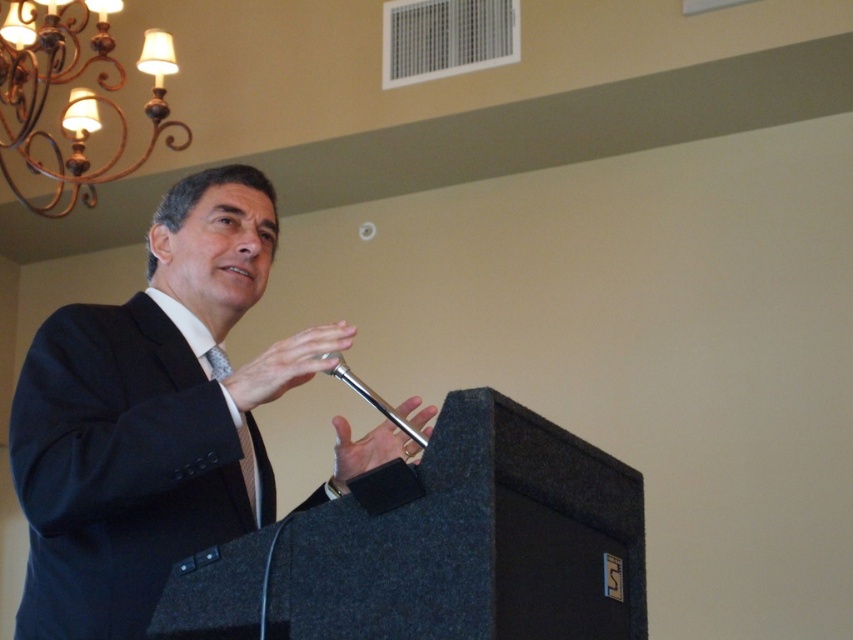
You are an event organizer and need to ensure that the microphone is visible to the audience. Given that the silky gray tie at center and silver metallic microphone at center are both at the center, which object is larger and thus more likely to be noticed by the audience?

The silver metallic microphone at center is larger than the silky gray tie at center, so it is more likely to be noticed by the audience.

You are attending a presentation and want to know which of the two points in the image is closer to you. The points are labeled as point 1 at coordinates point (90, 61) and point 2 at coordinates point (328, 356). Which point is closer?

Point 1 at coordinates point (90, 61) is closer to you than point 2 at coordinates point (328, 356) because the description states that point (90, 61) is further to the viewer than point (328, 356).